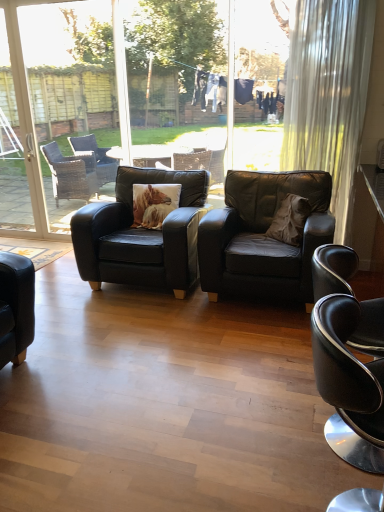
Question: Considering their positions, is white glass screen door at left, the 1th screen door viewed from the left, located in front of or behind transparent glass screen door at upper left, which is counted as the first screen door, starting from the right?

Choices:
 (A) front
 (B) behind

Answer: (B)

Question: Is white glass screen door at left, the 1th screen door viewed from the left, inside or outside of transparent glass screen door at upper left, which is counted as the first screen door, starting from the right?

Choices:
 (A) inside
 (B) outside

Answer: (B)

Question: Which is farther from the black leather chair at lower right, the 1th chair from the front?

Choices:
 (A) matte black armchair at center, the second chair viewed from the front
 (B) brown textured pillow at center, placed as the first pillow when sorted from left to right
 (C) matte black armchair at center, the 1th chair viewed from the back
 (D) white sheer curtain at right
 (E) transparent glass screen door at upper left, which is counted as the first screen door, starting from the right

Answer: (E)

Question: Estimate the real-world distances between objects in this image. Which object is farther from the white glass screen door at left, the 1th screen door viewed from the left?

Choices:
 (A) matte black armchair at center, the second chair viewed from the front
 (B) transparent glass screen door at upper left, which is counted as the first screen door, starting from the right
 (C) white sheer curtain at right
 (D) matte black armchair at center, the 1th chair viewed from the back
 (E) brown suede pillow at center, the 1th pillow positioned from the right

Answer: (C)